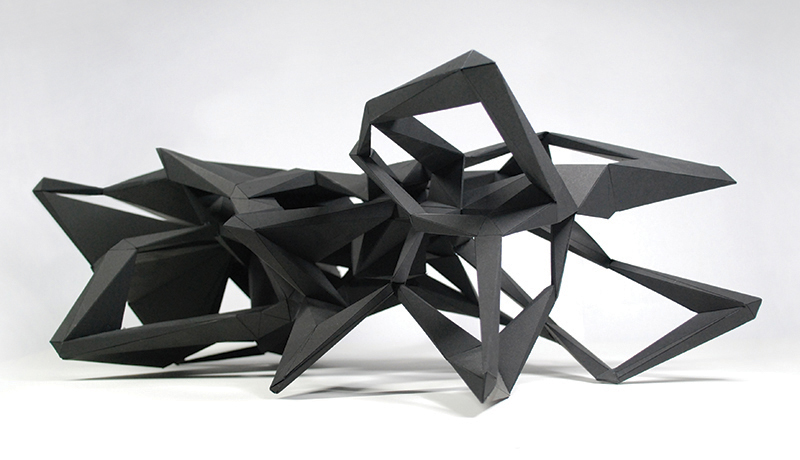
Find the location of `sculpture`. sculpture is located at coordinates (300, 254).